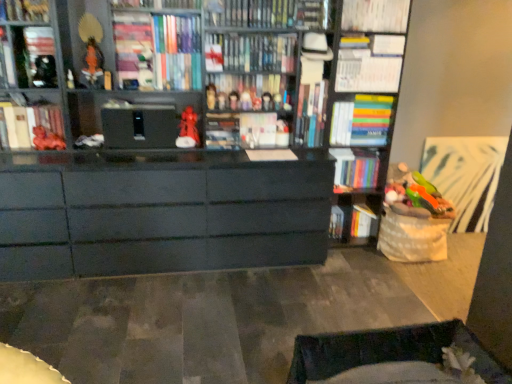
Question: Should I look upward or downward to see matte red figurine at center, the third toy when ordered from left to right?

Choices:
 (A) up
 (B) down

Answer: (A)

Question: Are matte red figurine at center, the 5th toy in the left-to-right sequence, and matte black bookshelf at upper left, arranged as the 4th book when viewed from the left, located far from each other?

Choices:
 (A) yes
 (B) no

Answer: (A)

Question: Is matte red figurine at center, which appears as the 3th toy when viewed from the right, wider than matte black bookshelf at upper left, arranged as the 4th book when viewed from the left?

Choices:
 (A) no
 (B) yes

Answer: (A)

Question: Is matte red figurine at center, which appears as the 3th toy when viewed from the right, with matte black bookshelf at upper left, which is counted as the tenth book, starting from the right?

Choices:
 (A) no
 (B) yes

Answer: (A)

Question: From the image's perspective, is matte red figurine at center, which appears as the 3th toy when viewed from the right, above matte black bookshelf at upper left, which is counted as the tenth book, starting from the right?

Choices:
 (A) no
 (B) yes

Answer: (A)

Question: From the image's perspective, would you say matte red figurine at center, which appears as the 3th toy when viewed from the right, is shown under matte black bookshelf at upper left, which is counted as the tenth book, starting from the right?

Choices:
 (A) yes
 (B) no

Answer: (A)

Question: From a real-world perspective, is matte red figurine at center, the 5th toy in the left-to-right sequence, over matte black bookshelf at upper left, which is counted as the tenth book, starting from the right?

Choices:
 (A) no
 (B) yes

Answer: (A)

Question: Is matte black bookshelf at upper left, positioned as the 3th book in left-to-right order, smaller than matte black book at upper left, the 1th book when ordered from left to right?

Choices:
 (A) yes
 (B) no

Answer: (B)

Question: Is matte black bookshelf at upper left, which appears as the 11th book when viewed from the right, facing towards matte black book at upper left, the 1th book when ordered from left to right?

Choices:
 (A) no
 (B) yes

Answer: (A)

Question: Would you say matte black book at upper left, the thirteenth book positioned from the right, is part of matte black bookshelf at upper left, positioned as the 3th book in left-to-right order,'s contents?

Choices:
 (A) yes
 (B) no

Answer: (B)

Question: Can you confirm if matte black bookshelf at upper left, positioned as the 3th book in left-to-right order, is wider than matte black book at upper left, the 1th book when ordered from left to right?

Choices:
 (A) no
 (B) yes

Answer: (B)

Question: Is the position of matte black bookshelf at upper left, positioned as the 3th book in left-to-right order, more distant than that of matte black book at upper left, the thirteenth book positioned from the right?

Choices:
 (A) yes
 (B) no

Answer: (B)

Question: Does matte black bookshelf at upper left, which appears as the 11th book when viewed from the right, have a larger size compared to matte black book at upper left, the 1th book when ordered from left to right?

Choices:
 (A) no
 (B) yes

Answer: (B)

Question: Are white paper at upper center, the 11th book when ordered from left to right, and matte red figurine at center, the 6th toy viewed from the left, far apart?

Choices:
 (A) no
 (B) yes

Answer: (A)